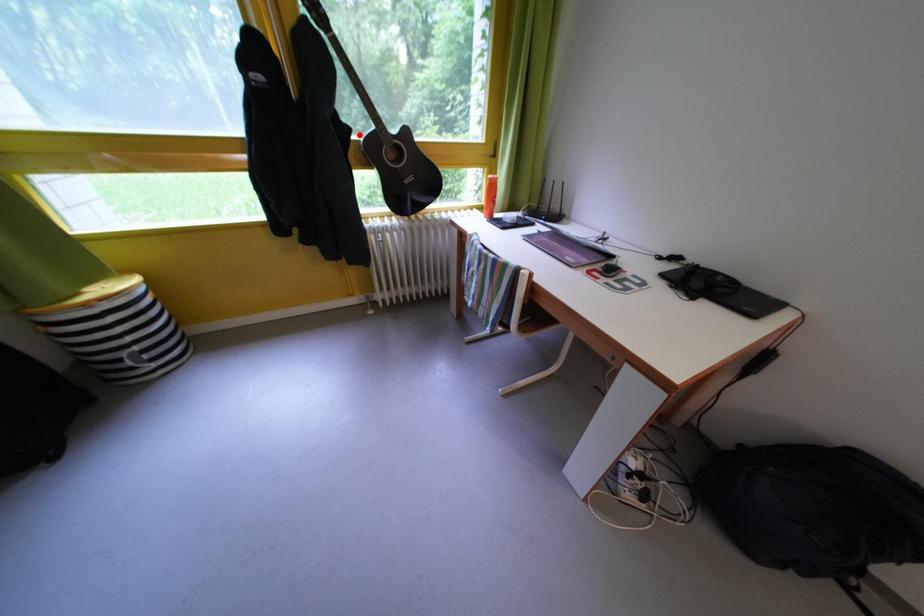
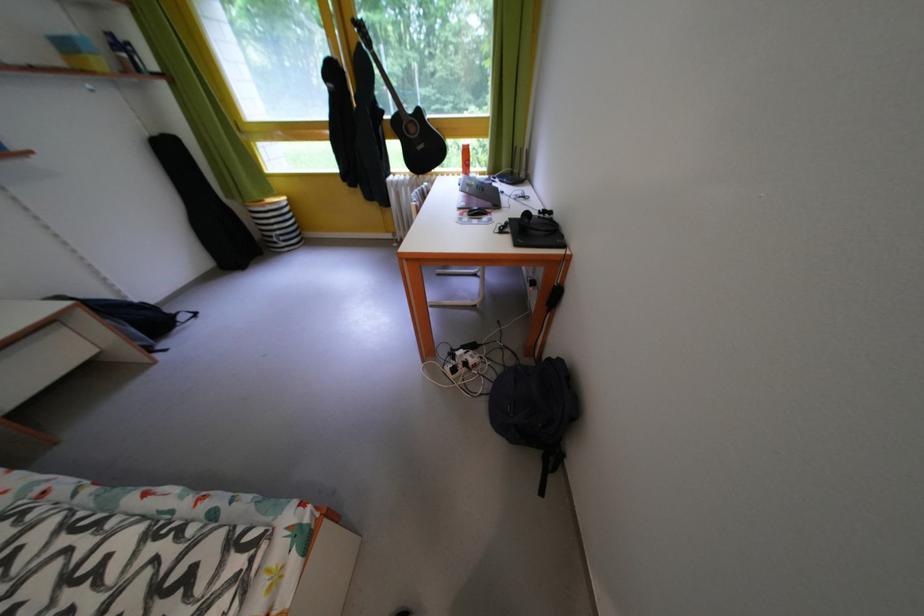
Find the pixel in the second image that matches the highlighted location in the first image.

(393, 118)